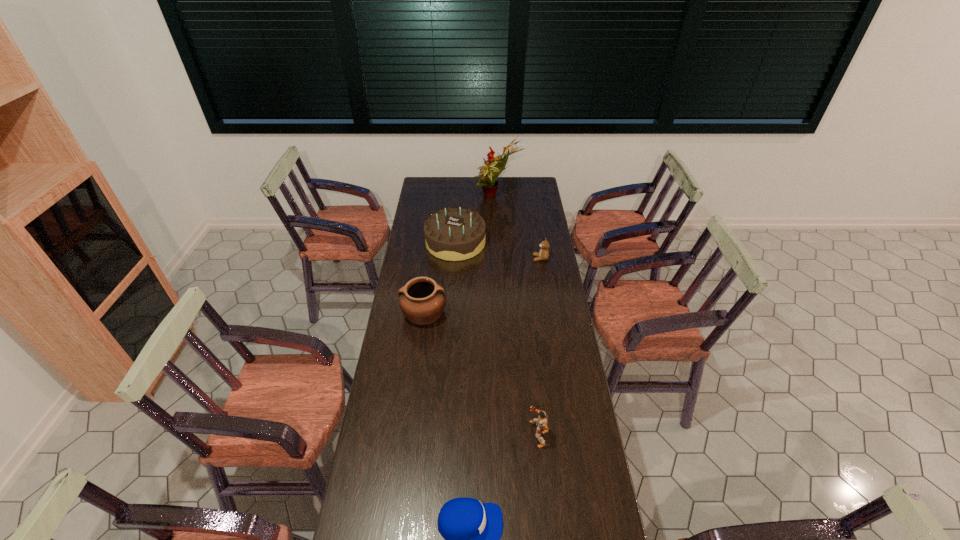
This screenshot has width=960, height=540. I want to click on pottery at the left edge, so click(422, 300).

At what (x,y) coordinates should I click in order to perform the action: click on bouquet that is at the right edge. Please return your answer as a coordinate pair (x, y). Image resolution: width=960 pixels, height=540 pixels. Looking at the image, I should click on (494, 166).

Find the location of a particular element. puncher that is at the right edge is located at coordinates (541, 422).

At what (x,y) coordinates should I click in order to perform the action: click on teddy bear located at the right edge. Please return your answer as a coordinate pair (x, y). Looking at the image, I should click on (543, 254).

Where is `object at the far right corner`? This screenshot has height=540, width=960. object at the far right corner is located at coordinates (494, 166).

Locate an element on the screen. The image size is (960, 540). vacant space at the far edge is located at coordinates (468, 191).

Locate an element on the screen. free space at the left edge of the desktop is located at coordinates (430, 268).

In the image, there is a desktop. Identify the location of free space at the right edge. This screenshot has height=540, width=960. (529, 273).

Locate an element on the screen. Image resolution: width=960 pixels, height=540 pixels. free location at the far left corner of the desktop is located at coordinates (431, 192).

In the image, there is a desktop. Identify the location of free space at the far right corner. This screenshot has width=960, height=540. (518, 182).